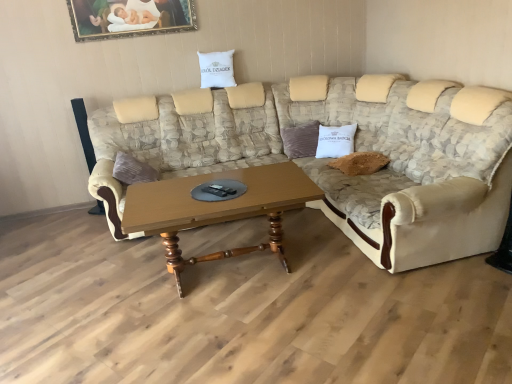
The width and height of the screenshot is (512, 384). Identify the location of empty space that is ontop of wooden polished coffee table at center (from a real-world perspective). click(233, 200).